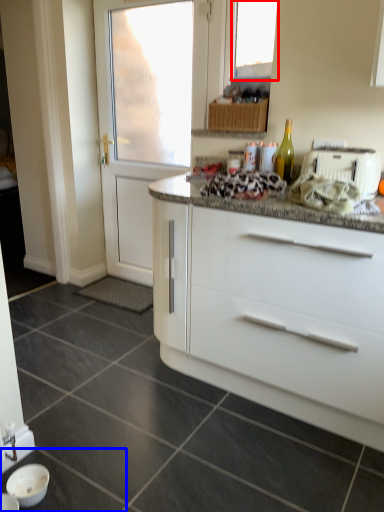
Question: Which point is further to the camera, window (highlighted by a red box) or tile (highlighted by a blue box)?

Choices:
 (A) window
 (B) tile

Answer: (A)